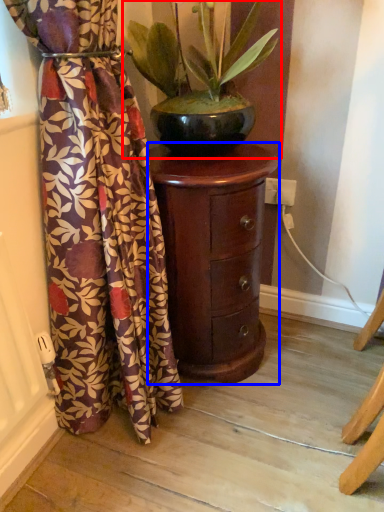
Question: Which object is closer to the camera taking this photo, houseplant (highlighted by a red box) or furniture (highlighted by a blue box)?

Choices:
 (A) houseplant
 (B) furniture

Answer: (A)